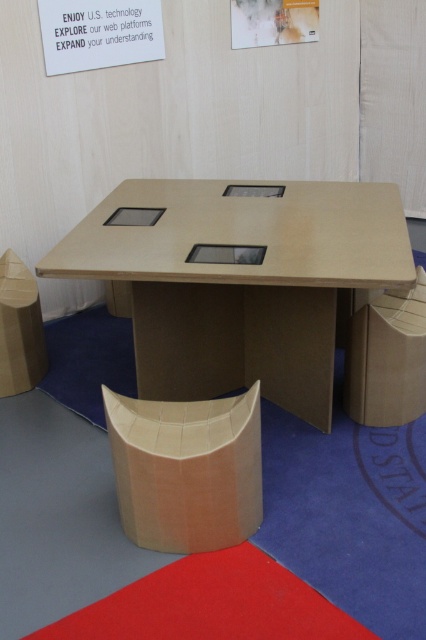
You are standing in front of the cardboard table setup and notice a matte cardboard box at center. If you want to reach it without moving your feet, is it within arm reach?

The matte cardboard box at center is 6.00 feet away from viewer, so it is out of arm reach. You would need to move closer to reach it.

You are standing in front of the table with cardboard chairs and boxes. You need to pick up the matte cardboard box at right and the matte cardboard box at left. Which one do you need to bend down less to pick up?

The matte cardboard box at right is closer to the viewer, so you would need to bend down less to pick up the matte cardboard box at right compared to the matte cardboard box at left.